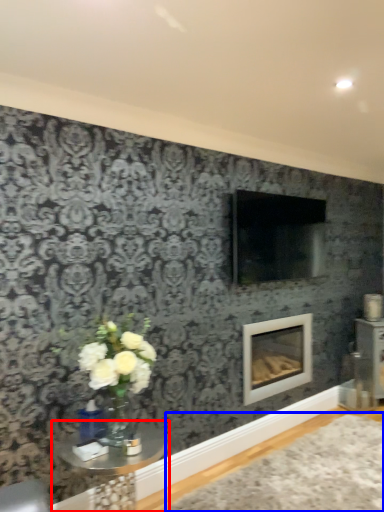
Question: Which point is closer to the camera, table (highlighted by a red box) or plain (highlighted by a blue box)?

Choices:
 (A) table
 (B) plain

Answer: (A)